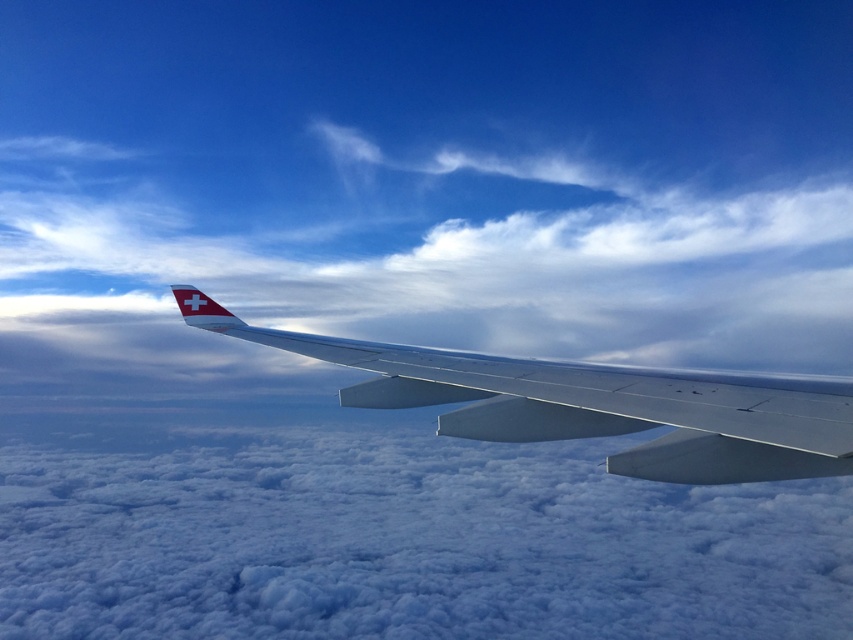
Question: Is white fluffy cloud at center thinner than metallic gray wing at center?

Choices:
 (A) no
 (B) yes

Answer: (A)

Question: Which point is closer to the camera?

Choices:
 (A) (500, 250)
 (B) (355, 358)

Answer: (B)

Question: Does white fluffy cloud at center have a lesser width compared to metallic gray wing at center?

Choices:
 (A) yes
 (B) no

Answer: (B)

Question: Among these objects, which one is farthest from the camera?

Choices:
 (A) white fluffy cloud at center
 (B) metallic gray wing at center

Answer: (A)

Question: Is white fluffy cloud at center smaller than metallic gray wing at center?

Choices:
 (A) yes
 (B) no

Answer: (B)